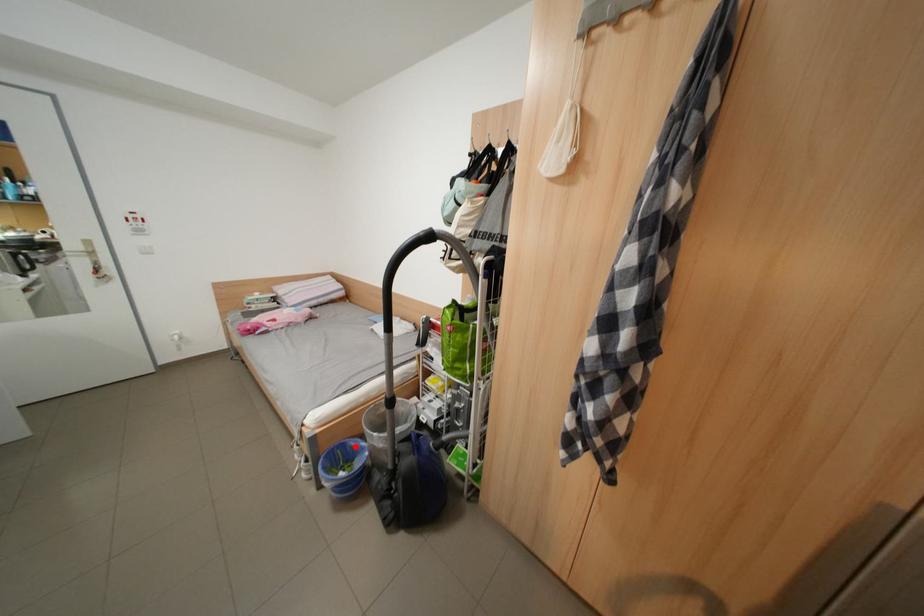
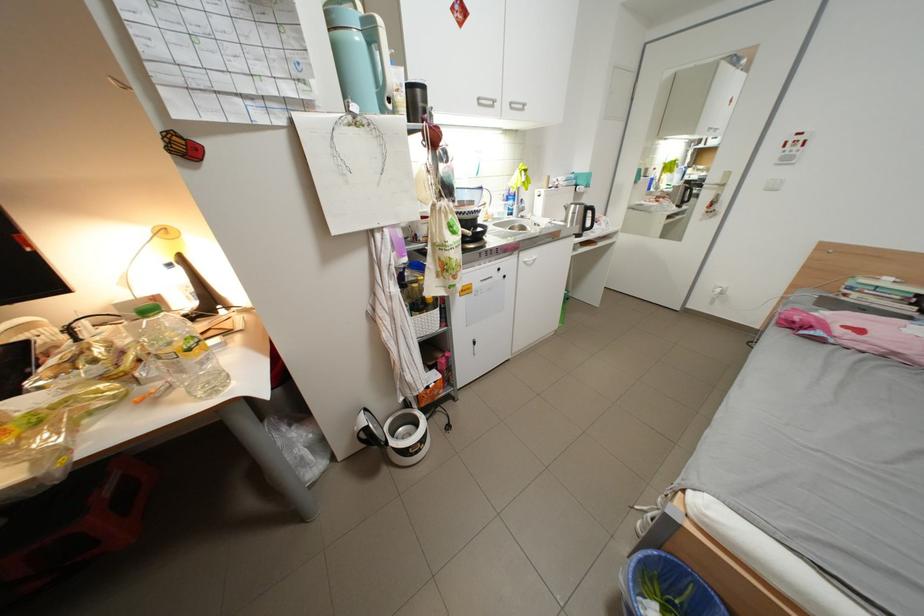
Question: A red point is marked in image1. In image2, is the corresponding 3D point closer to the camera or farther? Reply with the corresponding letter.

Choices:
 (A) The corresponding 3D point is closer.
 (B) The corresponding 3D point is farther.

Answer: (B)